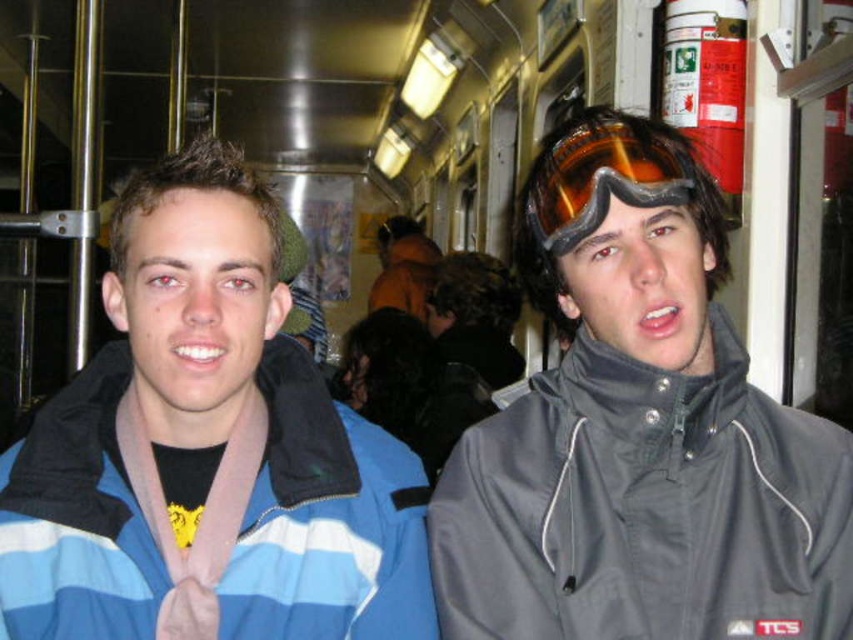
You are a clothing designer observing the two jackets in the image. Which of the two jackets, the gray matte jacket at center or the blue striped jacket at center, would you recommend for someone who wants a more voluminous look?

The gray matte jacket at center has a larger size compared to the blue striped jacket at center, so it would be the better choice for someone seeking a more voluminous look.

You are standing on the train and want to reach the point marked as point (85, 625). Can you safely step forward to that point without moving past it?

The point (85, 625) is 1.02 meters away from the viewer, so stepping forward to that point is safe as it is within reach without overstepping.